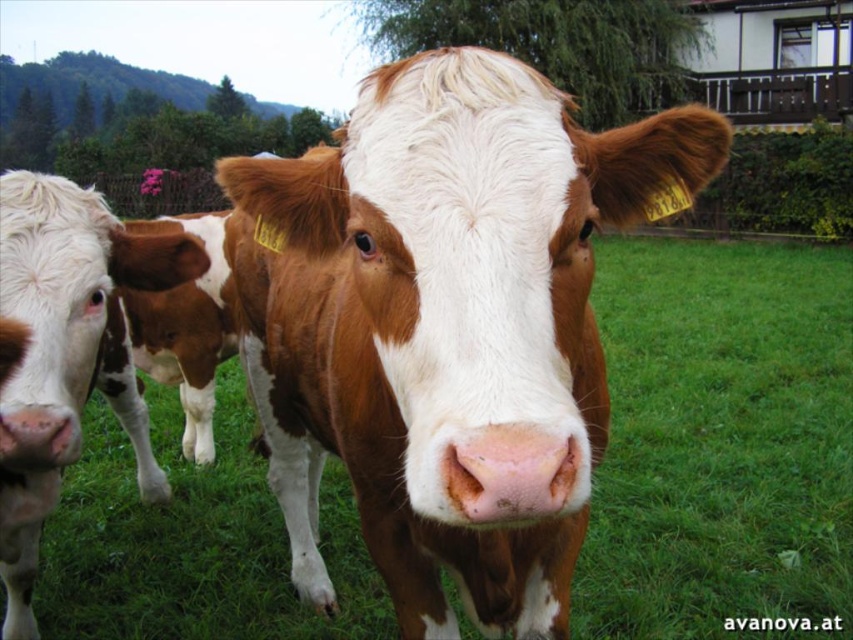
Question: Does green grass at center have a greater width compared to brown/white textured cow at center-left?

Choices:
 (A) yes
 (B) no

Answer: (A)

Question: Which object is farther from the camera taking this photo?

Choices:
 (A) brown/white fur at center
 (B) brown/white textured cow at center-left
 (C) green grass at center

Answer: (C)

Question: Can you confirm if green grass at center is bigger than brown/white textured cow at center?

Choices:
 (A) no
 (B) yes

Answer: (B)

Question: Considering the relative positions of brown/white fur at center and green grass at center in the image provided, where is brown/white fur at center located with respect to green grass at center?

Choices:
 (A) above
 (B) below

Answer: (A)

Question: Which point is farther to the camera?

Choices:
 (A) green grass at center
 (B) brown/white textured cow at center
 (C) brown/white textured cow at center-left

Answer: (A)

Question: Estimate the real-world distances between objects in this image. Which object is closer to the brown/white textured cow at center?

Choices:
 (A) green grass at center
 (B) brown/white textured cow at center-left
 (C) brown/white fur at center

Answer: (B)